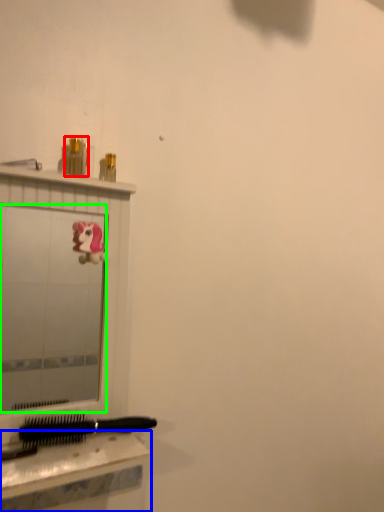
Question: Which object is positioned closest to toiletry (highlighted by a red box)? Select from table (highlighted by a blue box) and mirror (highlighted by a green box).

Choices:
 (A) table
 (B) mirror

Answer: (A)